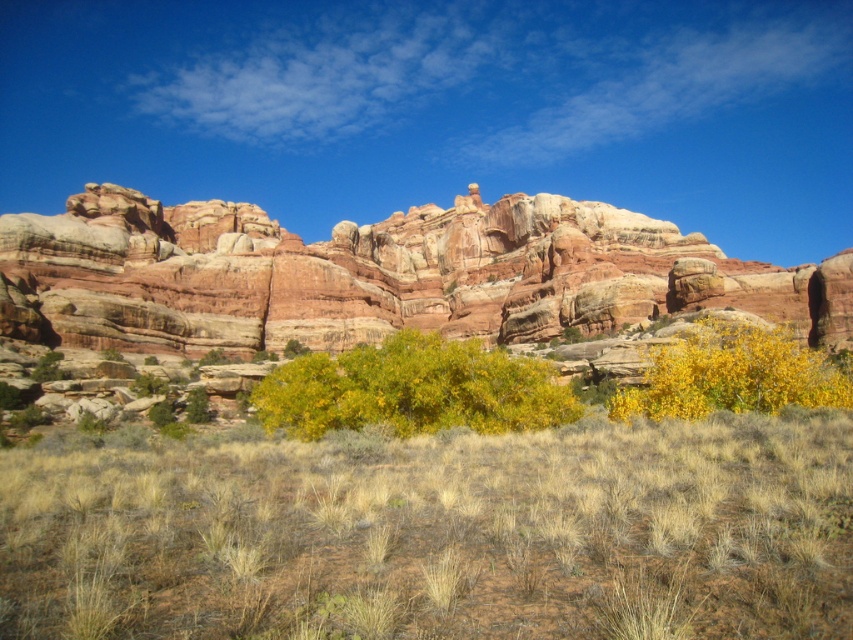
Where is `dry grass at center`? Image resolution: width=853 pixels, height=640 pixels. dry grass at center is located at coordinates (437, 532).

Can you confirm if dry grass at center is wider than yellow-green leafy bush at center?

Yes, dry grass at center is wider than yellow-green leafy bush at center.

Image resolution: width=853 pixels, height=640 pixels. In order to click on dry grass at center in this screenshot , I will do `click(437, 532)`.

Based on the photo, does dry grass at center lie behind yellow leafy bush at lower right?

No, dry grass at center is in front of yellow leafy bush at lower right.

Does dry grass at center have a greater width compared to yellow leafy bush at lower right?

Indeed, dry grass at center has a greater width compared to yellow leafy bush at lower right.

Is point (780, 484) positioned before point (785, 339)?

Yes, point (780, 484) is in front of point (785, 339).

Identify the location of dry grass at center. (437, 532).

Is yellow-green leafy bush at center smaller than yellow leafy bush at lower right?

No, yellow-green leafy bush at center is not smaller than yellow leafy bush at lower right.

How far apart are yellow-green leafy bush at center and yellow leafy bush at lower right?

yellow-green leafy bush at center and yellow leafy bush at lower right are 63.39 feet apart.

Which is in front, point (531, 378) or point (790, 387)?

Point (790, 387) is in front.

The image size is (853, 640). I want to click on yellow-green leafy bush at center, so click(x=413, y=388).